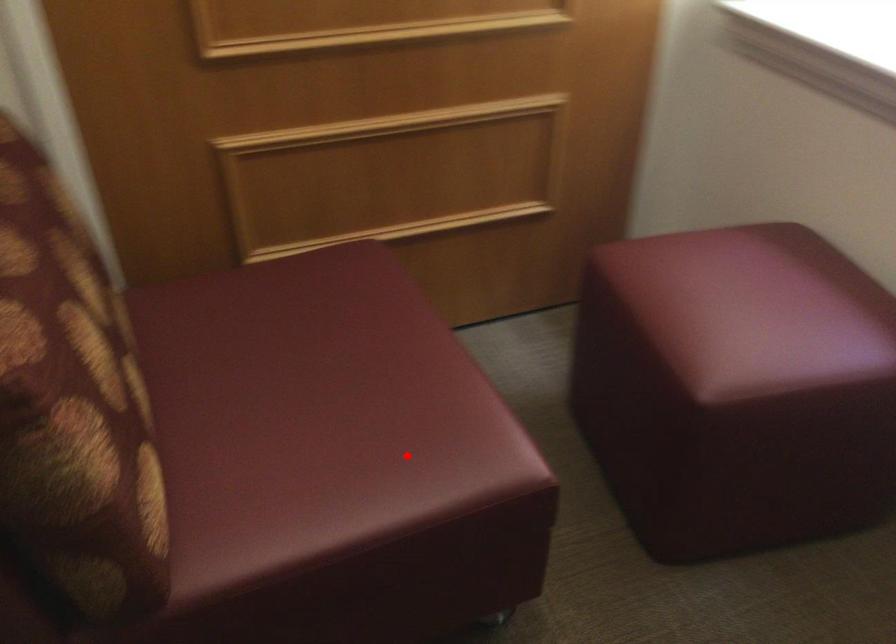
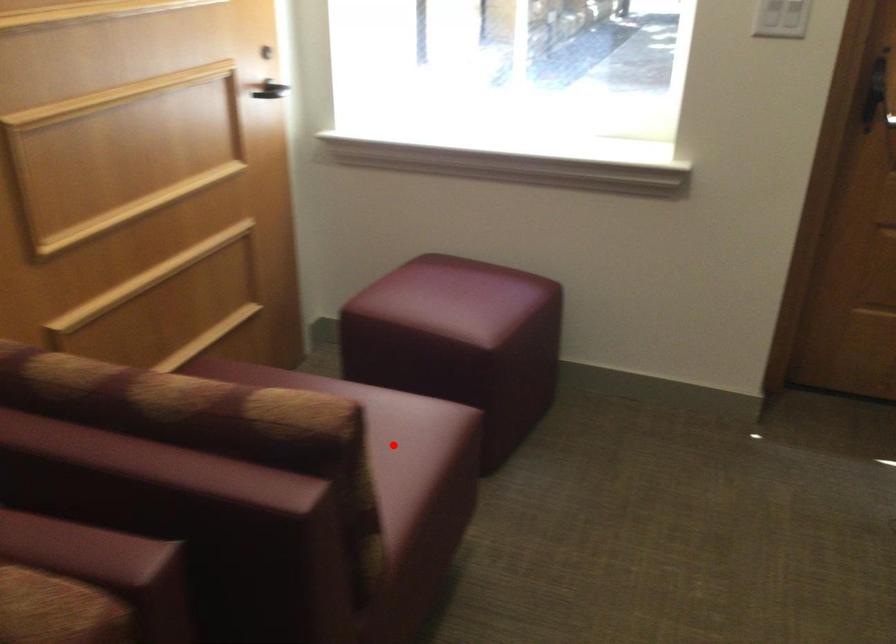
I am providing you with two images of the same scene from different viewpoints. A red point is marked on the first image and another point is marked on the second image. Is the red point in image1 aligned with the point shown in image2?

Yes